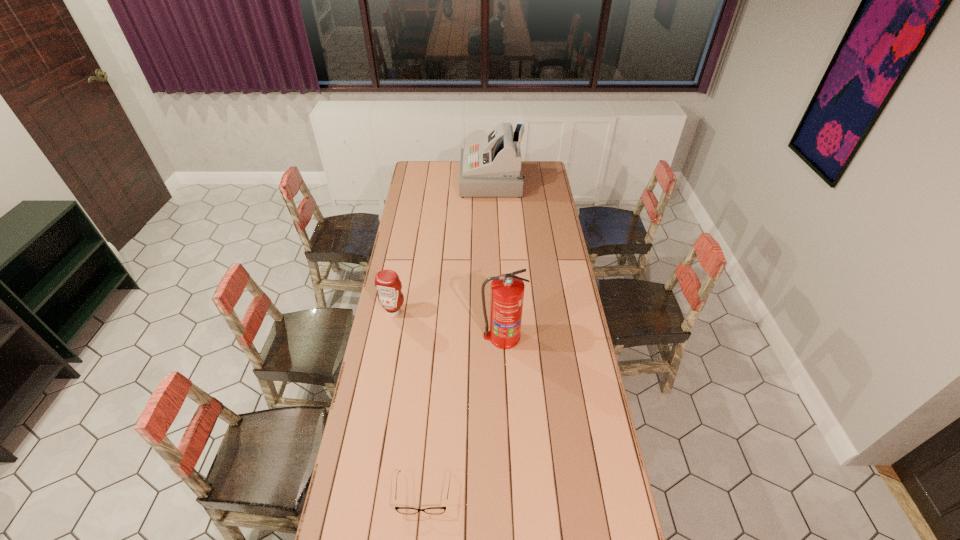
The height and width of the screenshot is (540, 960). Find the location of `cash register`. cash register is located at coordinates (492, 167).

At what (x,y) coordinates should I click in order to perform the action: click on the second nearest object. Please return your answer as a coordinate pair (x, y). The width and height of the screenshot is (960, 540). Looking at the image, I should click on (507, 290).

The image size is (960, 540). In order to click on the second shortest object in this screenshot , I will do `click(387, 282)`.

At what (x,y) coordinates should I click in order to perform the action: click on the third nearest object. Please return your answer as a coordinate pair (x, y). This screenshot has height=540, width=960. Looking at the image, I should click on (387, 282).

This screenshot has width=960, height=540. In order to click on spectacles in this screenshot , I will do `click(403, 510)`.

I want to click on the nearest object, so click(x=403, y=510).

Find the location of a particular element. The height and width of the screenshot is (540, 960). vacant space situated on the keypad side of the farthest object is located at coordinates (438, 180).

At what (x,y) coordinates should I click in order to perform the action: click on vacant region located 0.100m on the keypad side of the farthest object. Please return your answer as a coordinate pair (x, y). Looking at the image, I should click on (x=444, y=180).

The width and height of the screenshot is (960, 540). I want to click on vacant space located 0.070m on the keypad side of the farthest object, so click(x=449, y=180).

Identify the location of free location located 0.120m on the instruction side of the second nearest object. The width and height of the screenshot is (960, 540). (504, 374).